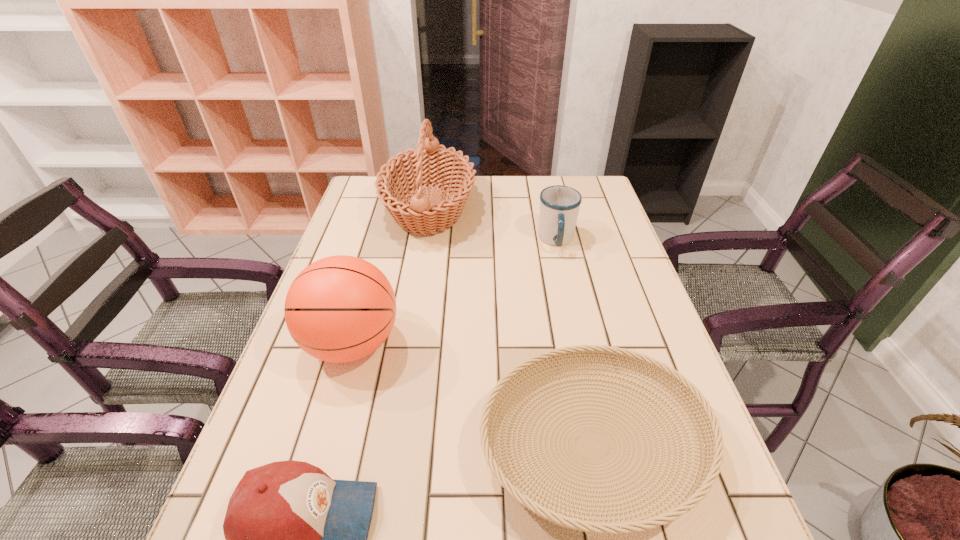
Identify the location of object that is the fourth closest to the fourth tallest object. (559, 205).

At what (x,y) coordinates should I click in order to perform the action: click on vacant space that satisfies the following two spatial constraints: 1. on the back side of the fourth shortest object; 2. on the left side of the taller basket. Please return your answer as a coordinate pair (x, y). The width and height of the screenshot is (960, 540). Looking at the image, I should click on (391, 209).

The width and height of the screenshot is (960, 540). Find the location of `vacant space that satisfies the following two spatial constraints: 1. on the back side of the basketball; 2. on the right side of the left basket`. vacant space that satisfies the following two spatial constraints: 1. on the back side of the basketball; 2. on the right side of the left basket is located at coordinates (391, 209).